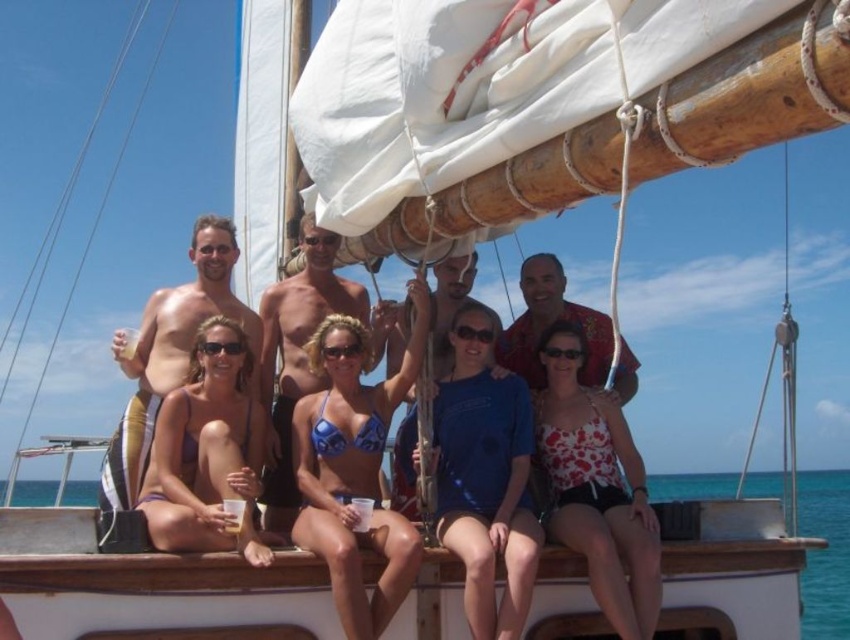
Question: Which point appears farthest from the camera in this image?

Choices:
 (A) (278, 349)
 (B) (412, 548)

Answer: (A)

Question: Is smooth tan skin at center further to the viewer compared to blue shirt at center?

Choices:
 (A) no
 (B) yes

Answer: (B)

Question: Which point is farther from the camera taking this photo?

Choices:
 (A) (435, 308)
 (B) (227, 356)

Answer: (A)

Question: Is blue bikini at center to the left of floral print bikini top at center from the viewer's perspective?

Choices:
 (A) yes
 (B) no

Answer: (A)

Question: Which object is farther from the camera taking this photo?

Choices:
 (A) shiny metallic torso at center
 (B) smooth tan skin at center
 (C) floral print bikini top at center

Answer: (B)

Question: Considering the relative positions of floral print bikini top at center and purple bikini at center in the image provided, where is floral print bikini top at center located with respect to purple bikini at center?

Choices:
 (A) right
 (B) left

Answer: (A)